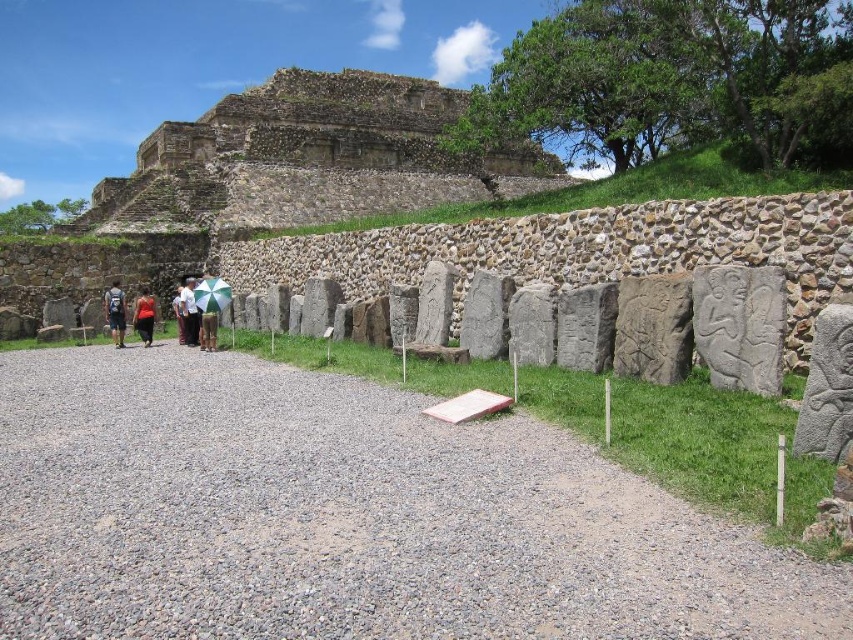
Question: Estimate the real-world distances between objects in this image. Which object is farther from the dark blue backpack at center?

Choices:
 (A) orange fabric dress at center
 (B) green striped umbrella at center

Answer: (B)

Question: Considering the relative positions of green striped umbrella at center and brown fabric shirt at center in the image provided, where is green striped umbrella at center located with respect to brown fabric shirt at center?

Choices:
 (A) below
 (B) above

Answer: (B)

Question: Where is orange fabric dress at center located in relation to green striped umbrella at center in the image?

Choices:
 (A) right
 (B) left

Answer: (B)

Question: Which point is farther from the camera taking this photo?

Choices:
 (A) (189, 307)
 (B) (354, 497)

Answer: (A)

Question: Considering the relative positions of orange fabric dress at center and green striped umbrella at center in the image provided, where is orange fabric dress at center located with respect to green striped umbrella at center?

Choices:
 (A) right
 (B) left

Answer: (B)

Question: Among these objects, which one is nearest to the camera?

Choices:
 (A) dark blue backpack at center
 (B) gray gravel path at center
 (C) green striped umbrella at center
 (D) brown leather jacket at center

Answer: (B)